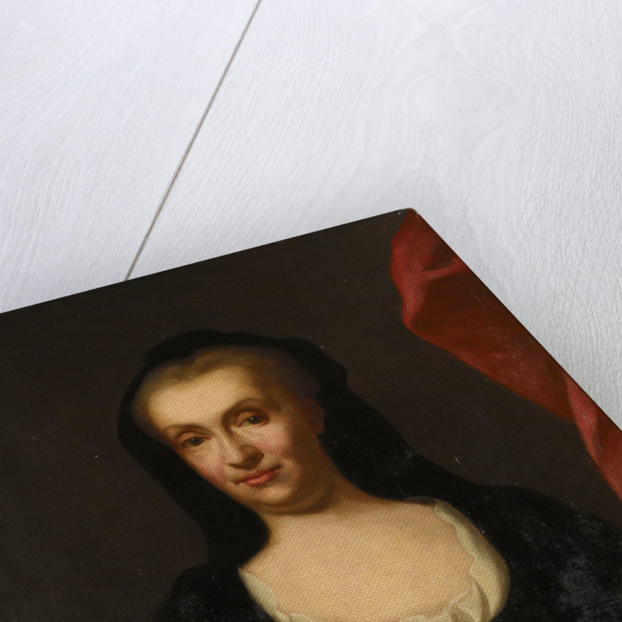
Where is `curtain`? curtain is located at coordinates (465, 315).